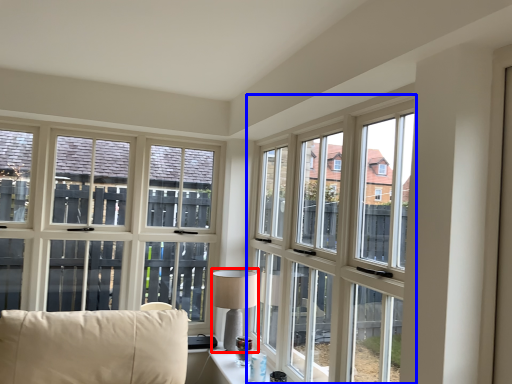
Question: Which object is further to the camera taking this photo, table lamp (highlighted by a red box) or window (highlighted by a blue box)?

Choices:
 (A) table lamp
 (B) window

Answer: (A)